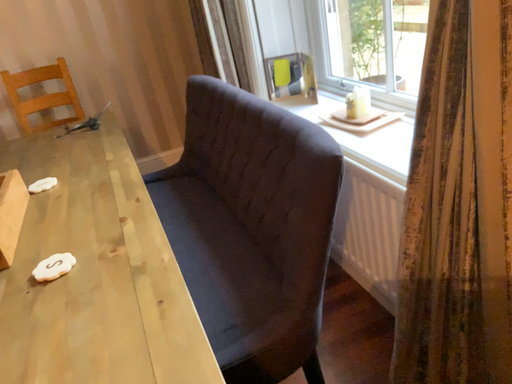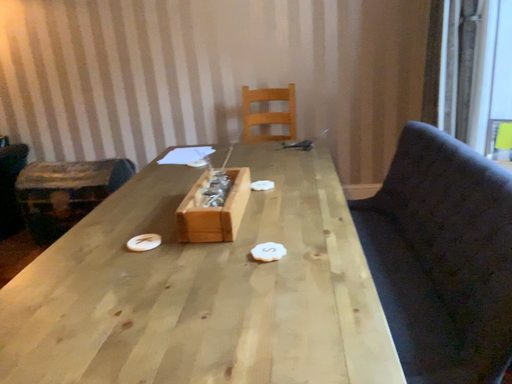
Question: How did the camera likely rotate when shooting the video?

Choices:
 (A) rotated right
 (B) rotated left

Answer: (B)